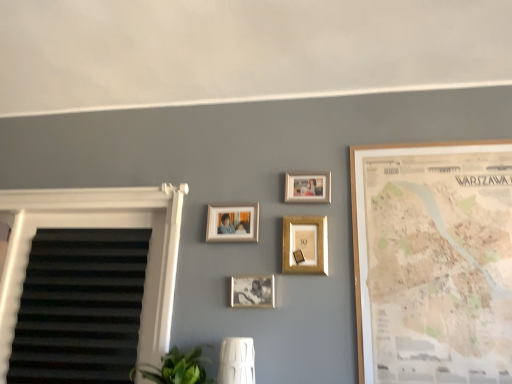
The width and height of the screenshot is (512, 384). Describe the element at coordinates (308, 187) in the screenshot. I see `matte gold picture frame at upper center, which is counted as the 4th picture frame, starting from the left` at that location.

What do you see at coordinates (433, 262) in the screenshot? I see `wooden map at right, acting as the 5th picture frame starting from the left` at bounding box center [433, 262].

Locate an element on the screen. green leafy plant at lower center is located at coordinates (177, 368).

Locate an element on the screen. This screenshot has height=384, width=512. white textured blind at left is located at coordinates (80, 307).

From the image's perspective, does wooden map at right, acting as the 5th picture frame starting from the left, appear higher than matte silver photo frame at center, which ranks as the first picture frame in left-to-right order?

No.

What are the coordinates of `the 3rd picture frame behind the wooden map at right, positioned as the 1th picture frame in right-to-left order, counting from the anchor's position` in the screenshot? It's located at (232, 223).

Is wooden map at right, acting as the 5th picture frame starting from the left, oriented towards matte silver photo frame at center, the fifth picture frame viewed from the right?

No.

Is wooden map at right, acting as the 5th picture frame starting from the left, to the left or to the right of matte silver photo frame at center, the fifth picture frame viewed from the right, in the image?

Based on their positions, wooden map at right, acting as the 5th picture frame starting from the left, is located to the right of matte silver photo frame at center, the fifth picture frame viewed from the right.

Who is taller, matte gold picture frame at upper center, which is counted as the 4th picture frame, starting from the left, or green leafy plant at lower center?

green leafy plant at lower center.

Between matte gold picture frame at upper center, which is the second picture frame from right to left, and green leafy plant at lower center, which one has larger width?

With larger width is green leafy plant at lower center.

From a real-world perspective, who is located lower, gold metallic picture frame at center, marked as the third picture frame in a right-to-left arrangement, or wooden map at right, acting as the 5th picture frame starting from the left?

In real-world perspective, wooden map at right, acting as the 5th picture frame starting from the left, is lower.

Between point (305, 230) and point (506, 212), which one is positioned behind?

Point (305, 230)

Choose the correct answer: Is gold metallic picture frame at center, marked as the third picture frame in a right-to-left arrangement, inside wooden map at right, positioned as the 1th picture frame in right-to-left order, or outside it?

gold metallic picture frame at center, marked as the third picture frame in a right-to-left arrangement, is outside wooden map at right, positioned as the 1th picture frame in right-to-left order.

Considering the relative sizes of gold metallic picture frame at center, positioned as the 3th picture frame in left-to-right order, and wooden map at right, acting as the 5th picture frame starting from the left, in the image provided, is gold metallic picture frame at center, positioned as the 3th picture frame in left-to-right order, thinner than wooden map at right, acting as the 5th picture frame starting from the left,?

No, gold metallic picture frame at center, positioned as the 3th picture frame in left-to-right order, is not thinner than wooden map at right, acting as the 5th picture frame starting from the left.

Is gold metallic picture frame at center, marked as the third picture frame in a right-to-left arrangement, in contact with matte gold picture frame at upper center, which is counted as the 4th picture frame, starting from the left?

No, gold metallic picture frame at center, marked as the third picture frame in a right-to-left arrangement, is not in contact with matte gold picture frame at upper center, which is counted as the 4th picture frame, starting from the left.

Can we say gold metallic picture frame at center, marked as the third picture frame in a right-to-left arrangement, lies outside matte gold picture frame at upper center, which is counted as the 4th picture frame, starting from the left?

Absolutely, gold metallic picture frame at center, marked as the third picture frame in a right-to-left arrangement, is external to matte gold picture frame at upper center, which is counted as the 4th picture frame, starting from the left.

Which of these two, gold metallic picture frame at center, positioned as the 3th picture frame in left-to-right order, or matte gold picture frame at upper center, which is counted as the 4th picture frame, starting from the left, is wider?

With larger width is gold metallic picture frame at center, positioned as the 3th picture frame in left-to-right order.

Is point (188, 379) less distant than point (384, 222)?

Yes, it is in front of point (384, 222).

Can you confirm if green leafy plant at lower center is shorter than wooden map at right, positioned as the 1th picture frame in right-to-left order?

Correct, green leafy plant at lower center is not as tall as wooden map at right, positioned as the 1th picture frame in right-to-left order.

Is green leafy plant at lower center to the left or to the right of wooden map at right, acting as the 5th picture frame starting from the left, in the image?

green leafy plant at lower center is to the left of wooden map at right, acting as the 5th picture frame starting from the left.

Is green leafy plant at lower center aimed at wooden map at right, acting as the 5th picture frame starting from the left?

No, green leafy plant at lower center is not turned towards wooden map at right, acting as the 5th picture frame starting from the left.

In the scene shown: Who is taller, wooden map at right, positioned as the 1th picture frame in right-to-left order, or metallic silver photo frame at center, arranged as the fourth picture frame when viewed from the right?

Standing taller between the two is wooden map at right, positioned as the 1th picture frame in right-to-left order.

Can you confirm if wooden map at right, positioned as the 1th picture frame in right-to-left order, is smaller than metallic silver photo frame at center, which is the 2th picture frame in left-to-right order?

No.

Which object is further away from the camera, wooden map at right, acting as the 5th picture frame starting from the left, or metallic silver photo frame at center, which is the 2th picture frame in left-to-right order?

Positioned behind is metallic silver photo frame at center, which is the 2th picture frame in left-to-right order.

From the picture: Is wooden map at right, positioned as the 1th picture frame in right-to-left order, positioned with its back to metallic silver photo frame at center, which is the 2th picture frame in left-to-right order?

No, wooden map at right, positioned as the 1th picture frame in right-to-left order, is not facing away from metallic silver photo frame at center, which is the 2th picture frame in left-to-right order.

From the image's perspective, between matte silver photo frame at center, which ranks as the first picture frame in left-to-right order, and wooden map at right, acting as the 5th picture frame starting from the left, which one is located above?

From the image's view, matte silver photo frame at center, which ranks as the first picture frame in left-to-right order, is above.

From the image's perspective, starting from the wooden map at right, positioned as the 1th picture frame in right-to-left order, which picture frame is the 2nd one above? Please provide its 2D coordinates.

[(232, 223)]

How different are the orientations of matte silver photo frame at center, the fifth picture frame viewed from the right, and wooden map at right, positioned as the 1th picture frame in right-to-left order, in degrees?

The facing directions of matte silver photo frame at center, the fifth picture frame viewed from the right, and wooden map at right, positioned as the 1th picture frame in right-to-left order, are 0.00523 degrees apart.

From their relative heights in the image, would you say matte silver photo frame at center, the fifth picture frame viewed from the right, is taller or shorter than wooden map at right, positioned as the 1th picture frame in right-to-left order?

Considering their sizes, matte silver photo frame at center, the fifth picture frame viewed from the right, has less height than wooden map at right, positioned as the 1th picture frame in right-to-left order.

Starting from the wooden map at right, positioned as the 1th picture frame in right-to-left order, which picture frame is the 4th one to the left? Please provide its 2D coordinates.

[(232, 223)]

Find the location of a particular element. This screenshot has width=512, height=384. the 5th picture frame directly above the green leafy plant at lower center (from a real-world perspective) is located at coordinates (308, 187).

Based on their spatial positions, is green leafy plant at lower center or metallic silver photo frame at center, which is the 2th picture frame in left-to-right order, closer to matte silver photo frame at center, which ranks as the first picture frame in left-to-right order?

Based on the image, metallic silver photo frame at center, which is the 2th picture frame in left-to-right order, appears to be nearer to matte silver photo frame at center, which ranks as the first picture frame in left-to-right order.

Which object lies further to the anchor point metallic silver photo frame at center, which is the 2th picture frame in left-to-right order, matte gold picture frame at upper center, which is the second picture frame from right to left, or wooden map at right, acting as the 5th picture frame starting from the left?

wooden map at right, acting as the 5th picture frame starting from the left, is positioned further to the anchor metallic silver photo frame at center, which is the 2th picture frame in left-to-right order.

Considering their positions, is matte gold picture frame at upper center, which is the second picture frame from right to left, positioned further to metallic silver photo frame at center, arranged as the fourth picture frame when viewed from the right, than gold metallic picture frame at center, marked as the third picture frame in a right-to-left arrangement?

matte gold picture frame at upper center, which is the second picture frame from right to left, is further to metallic silver photo frame at center, arranged as the fourth picture frame when viewed from the right.

When comparing their distances from metallic silver photo frame at center, which is the 2th picture frame in left-to-right order, does gold metallic picture frame at center, positioned as the 3th picture frame in left-to-right order, or matte gold picture frame at upper center, which is the second picture frame from right to left, seem closer?

gold metallic picture frame at center, positioned as the 3th picture frame in left-to-right order.

Looking at the image, which one is located closer to matte silver photo frame at center, which ranks as the first picture frame in left-to-right order, wooden map at right, positioned as the 1th picture frame in right-to-left order, or green leafy plant at lower center?

Among the two, green leafy plant at lower center is located nearer to matte silver photo frame at center, which ranks as the first picture frame in left-to-right order.

When comparing their distances from metallic silver photo frame at center, arranged as the fourth picture frame when viewed from the right, does matte silver photo frame at center, which ranks as the first picture frame in left-to-right order, or white textured blind at left seem closer?

matte silver photo frame at center, which ranks as the first picture frame in left-to-right order, lies closer to metallic silver photo frame at center, arranged as the fourth picture frame when viewed from the right, than the other object.

Considering their positions, is white textured blind at left positioned closer to matte gold picture frame at upper center, which is counted as the 4th picture frame, starting from the left, than metallic silver photo frame at center, arranged as the fourth picture frame when viewed from the right?

metallic silver photo frame at center, arranged as the fourth picture frame when viewed from the right.

Considering their positions, is matte gold picture frame at upper center, which is the second picture frame from right to left, positioned closer to gold metallic picture frame at center, positioned as the 3th picture frame in left-to-right order, than matte silver photo frame at center, the fifth picture frame viewed from the right?

matte gold picture frame at upper center, which is the second picture frame from right to left, is closer to gold metallic picture frame at center, positioned as the 3th picture frame in left-to-right order.

Locate an element on the screen. plant situated between white textured blind at left and gold metallic picture frame at center, marked as the third picture frame in a right-to-left arrangement, from left to right is located at coordinates (177, 368).

You are a GUI agent. You are given a task and a screenshot of the screen. Output one action in this format:
    pyautogui.click(x=<x>, y=<y>)
    Task: Click on the plant between white textured blind at left and matte gold picture frame at upper center, which is counted as the 4th picture frame, starting from the left, from left to right
    
    Given the screenshot: What is the action you would take?
    pyautogui.click(x=177, y=368)

Locate an element on the screen. plant between white textured blind at left and matte silver photo frame at center, the fifth picture frame viewed from the right, in the horizontal direction is located at coordinates (177, 368).

Where is `picture frame between gold metallic picture frame at center, marked as the third picture frame in a right-to-left arrangement, and wooden map at right, acting as the 5th picture frame starting from the left, from left to right`? The height and width of the screenshot is (384, 512). picture frame between gold metallic picture frame at center, marked as the third picture frame in a right-to-left arrangement, and wooden map at right, acting as the 5th picture frame starting from the left, from left to right is located at coordinates (308, 187).